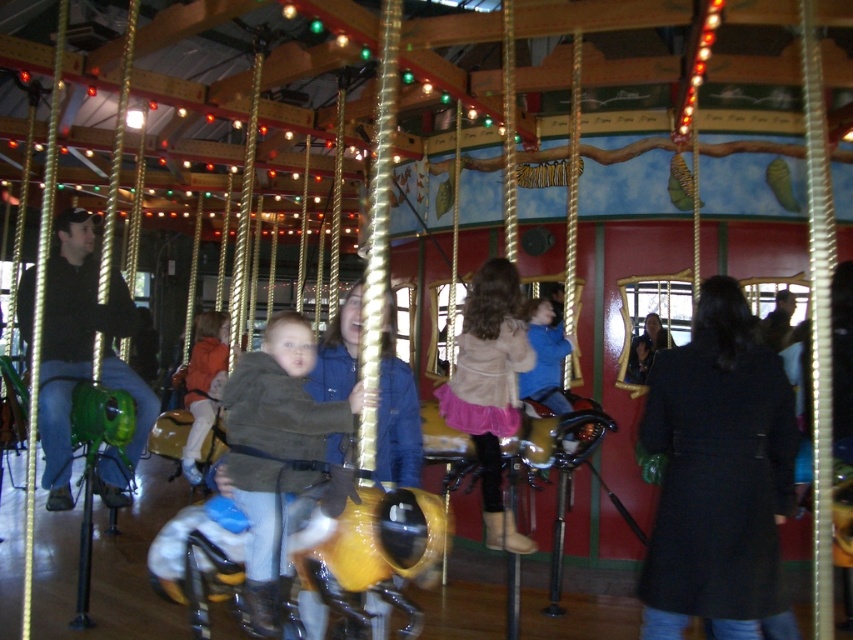
Question: Based on their relative distances, which object is farther from the pink satin skirt at center?

Choices:
 (A) brown leather jacket at center
 (B) orange fleece jacket at center

Answer: (B)

Question: Is pink satin skirt at center positioned at the back of orange fleece jacket at center?

Choices:
 (A) no
 (B) yes

Answer: (A)

Question: Which point is farther to the camera?

Choices:
 (A) (257, 570)
 (B) (223, 358)
 (C) (518, 292)

Answer: (B)

Question: Is brown leather jacket at center to the left of orange fleece jacket at center from the viewer's perspective?

Choices:
 (A) no
 (B) yes

Answer: (A)

Question: Does brown leather jacket at center have a lesser width compared to pink satin skirt at center?

Choices:
 (A) yes
 (B) no

Answer: (B)

Question: Among these points, which one is farthest from the camera?

Choices:
 (A) (323, 424)
 (B) (200, 417)

Answer: (B)